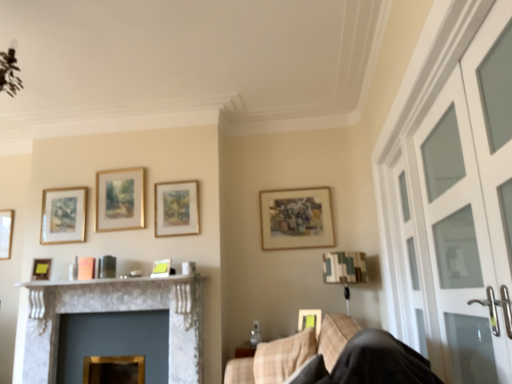
Question: Based on their sizes in the image, would you say beige fabric swivel chair at lower right is bigger or smaller than gold-framed picture at upper center, which appears as the fifth picture frame when viewed from the right?

Choices:
 (A) big
 (B) small

Answer: (A)

Question: From a real-world perspective, is beige fabric swivel chair at lower right physically located above or below gold-framed picture at upper center, which appears as the fifth picture frame when viewed from the right?

Choices:
 (A) below
 (B) above

Answer: (A)

Question: Which object is positioned farthest from the gold-framed picture at center, marked as the 3th picture frame in a right-to-left arrangement?

Choices:
 (A) gold-framed picture at upper center, marked as the 4th picture frame in a left-to-right arrangement
 (B) matte gold picture frame at upper center, which appears as the second picture frame when viewed from the right
 (C) camouflage fabric lampshade at upper right
 (D) matte gold picture frame at left, which is the 7th picture frame in right-to-left order
 (E) clear glass screen door at right, placed as the second screen door when sorted from front to back

Answer: (E)

Question: Considering the real-world distances, which object is closest to the plaid fabric chair at lower right?

Choices:
 (A) camouflage fabric lampshade at upper right
 (B) white frosted glass screen door at right, acting as the 2th screen door starting from the back
 (C) clear glass screen door at right, which is the first screen door from back to front
 (D) matte gold picture frame at upper center, the seventh picture frame positioned from the left
 (E) gold-framed picture at upper center, which appears as the fifth picture frame when viewed from the right

Answer: (B)